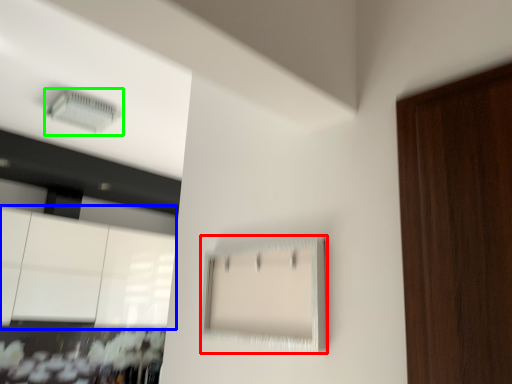
Question: Which is farther away from cabinetry (highlighted by a red box)? cabinetry (highlighted by a blue box) or air conditioning (highlighted by a green box)?

Choices:
 (A) cabinetry
 (B) air conditioning

Answer: (A)